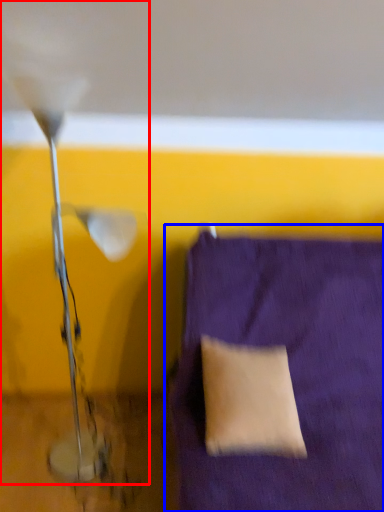
Question: Which of the following is the closest to the observer, lamp (highlighted by a red box) or furniture (highlighted by a blue box)?

Choices:
 (A) lamp
 (B) furniture

Answer: (B)